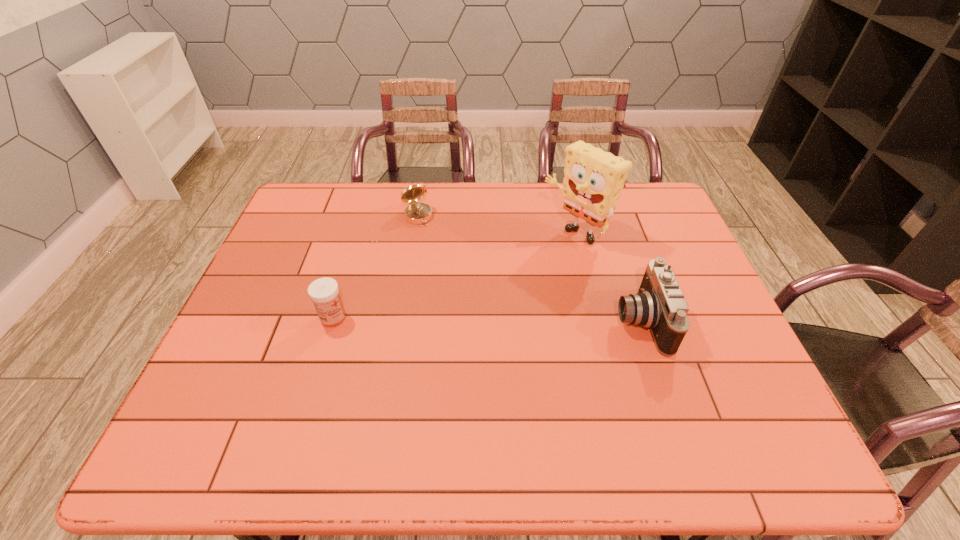
The image size is (960, 540). What are the coordinates of `vacant space at the right edge of the desktop` in the screenshot? It's located at (711, 338).

You are a GUI agent. You are given a task and a screenshot of the screen. Output one action in this format:
    pyautogui.click(x=<x>, y=<y>)
    Task: Click on the free space at the far left corner of the desktop
    This screenshot has height=540, width=960.
    Given the screenshot: What is the action you would take?
    pyautogui.click(x=324, y=212)

In the image, there is a desktop. Where is `vacant space at the near left corner`? The image size is (960, 540). vacant space at the near left corner is located at coordinates (213, 377).

The height and width of the screenshot is (540, 960). I want to click on vacant space at the near right corner of the desktop, so click(x=750, y=408).

This screenshot has height=540, width=960. I want to click on vacant area that lies between the second object from left to right and the camera, so click(529, 269).

The height and width of the screenshot is (540, 960). What are the coordinates of `unoccupied position between the compass and the tallest object` in the screenshot? It's located at (496, 225).

The image size is (960, 540). I want to click on free point between the camera and the medicine, so 487,320.

I want to click on free space between the tallest object and the leftmost object, so click(x=454, y=276).

The height and width of the screenshot is (540, 960). What are the coordinates of `unoccupied area between the tallest object and the leftmost object` in the screenshot? It's located at (454, 276).

Locate an element on the screen. The height and width of the screenshot is (540, 960). free space between the medicine and the camera is located at coordinates (487, 320).